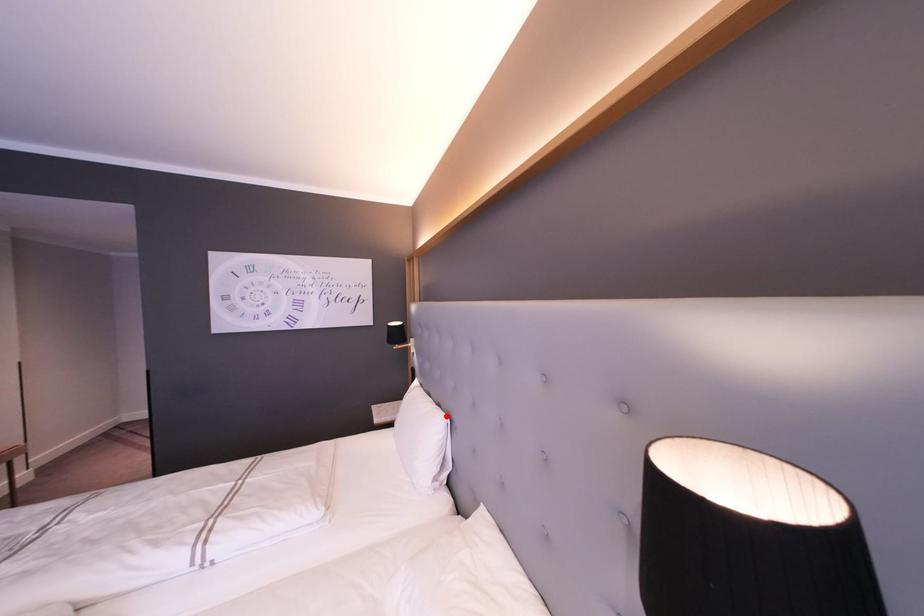
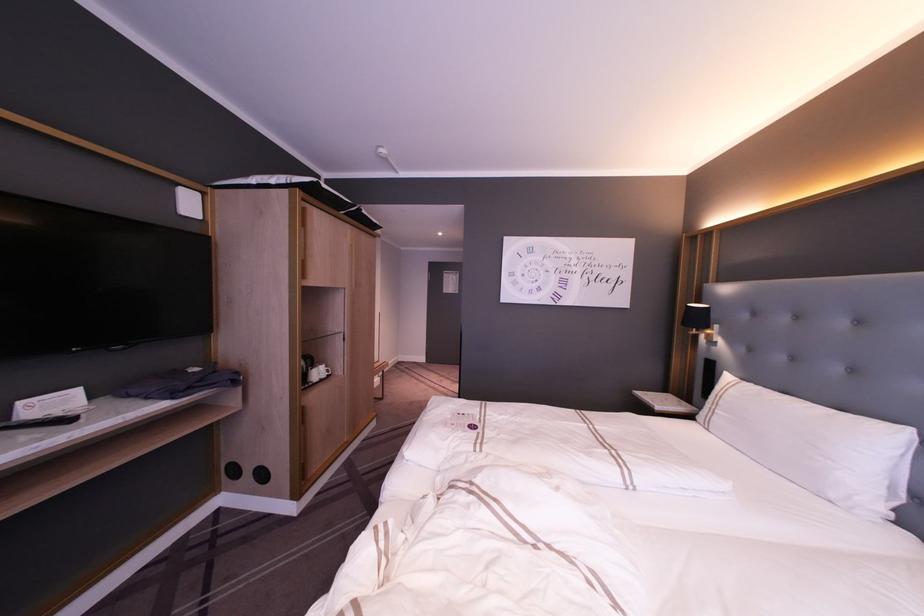
In the second image, find the point that corresponds to the highlighted location in the first image.

(910, 429)